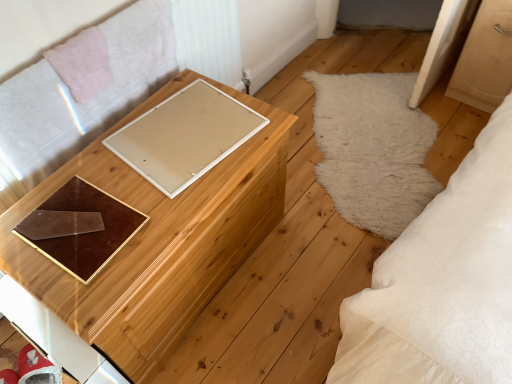
You are a GUI agent. You are given a task and a screenshot of the screen. Output one action in this format:
    pyautogui.click(x=<x>, y=<y>)
    Task: Click on the vacant area that is situated to the right of brown glossy tray at center
    The height and width of the screenshot is (384, 512).
    Given the screenshot: What is the action you would take?
    pyautogui.click(x=157, y=216)